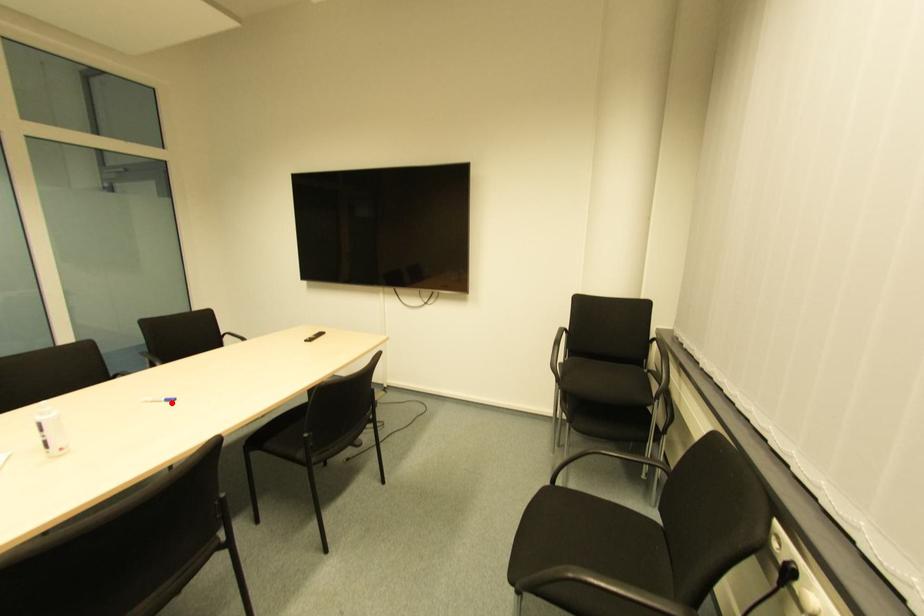
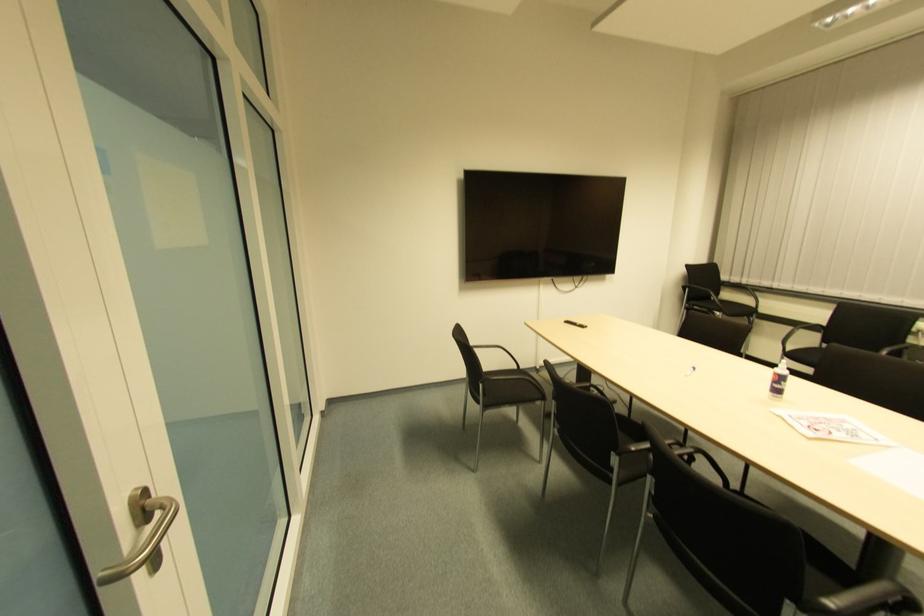
Find the pixel in the second image that matches the highlighted location in the first image.

(691, 371)